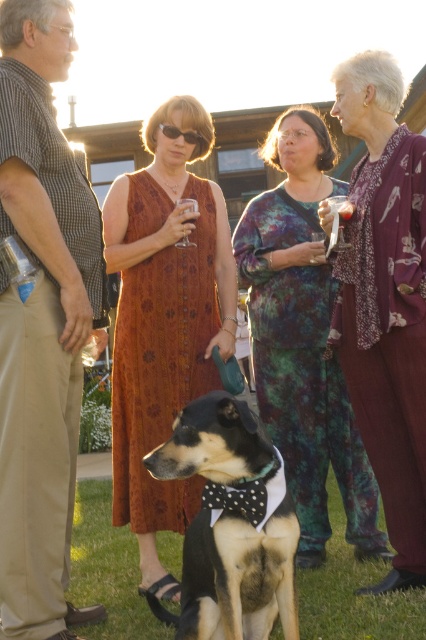
Between khaki cotton pants at center and multicolored tie-dye dress at center, which one has more height?

With more height is khaki cotton pants at center.

Does point (5, 429) come behind point (250, 288)?

That is False.

You are a GUI agent. You are given a task and a screenshot of the screen. Output one action in this format:
    pyautogui.click(x=<x>, y=<y>)
    Task: Click on the khaki cotton pants at center
    The height and width of the screenshot is (640, 426).
    Given the screenshot: What is the action you would take?
    pyautogui.click(x=40, y=321)

Between purple floral dress at upper right and clear glass wine glass at center, which one appears on the left side from the viewer's perspective?

clear glass wine glass at center is more to the left.

Consider the image. Does purple floral dress at upper right have a lesser width compared to clear glass wine glass at center?

In fact, purple floral dress at upper right might be wider than clear glass wine glass at center.

The image size is (426, 640). Describe the element at coordinates (385, 301) in the screenshot. I see `purple floral dress at upper right` at that location.

Identify the location of purple floral dress at upper right. (385, 301).

Can you confirm if orange floral dress at center is positioned to the right of purple floral dress at upper right?

In fact, orange floral dress at center is to the left of purple floral dress at upper right.

Describe the element at coordinates (164, 320) in the screenshot. This screenshot has height=640, width=426. I see `orange floral dress at center` at that location.

Which is in front, point (140, 225) or point (411, 536)?

Point (411, 536) is more forward.

At what (x,y) coordinates should I click in order to perform the action: click on orange floral dress at center. Please return your answer as a coordinate pair (x, y). The width and height of the screenshot is (426, 640). Looking at the image, I should click on (164, 320).